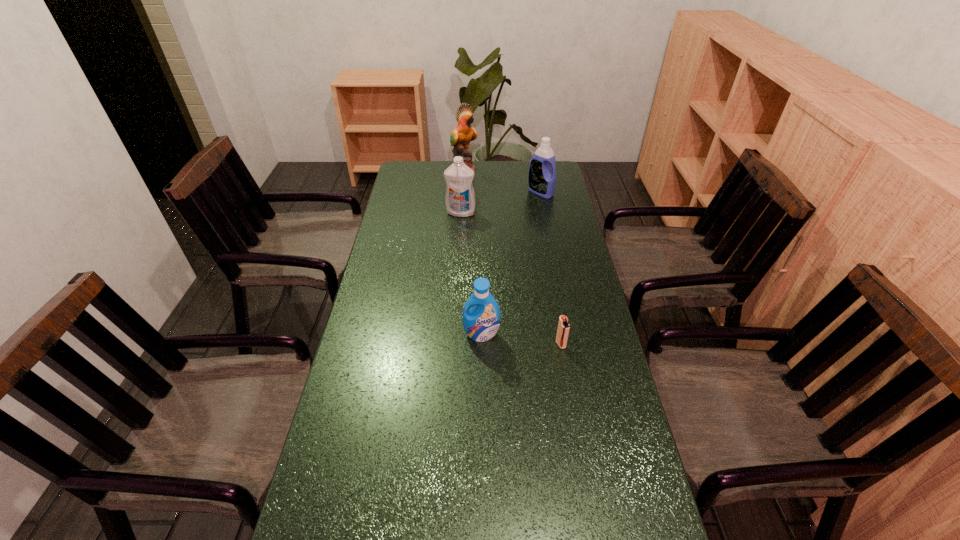
Locate an element on the screen. vacant space at the right edge of the desktop is located at coordinates (567, 253).

You are a GUI agent. You are given a task and a screenshot of the screen. Output one action in this format:
    pyautogui.click(x=<x>, y=<y>)
    Task: Click on the free space at the far left corner
    
    Given the screenshot: What is the action you would take?
    pyautogui.click(x=433, y=168)

This screenshot has width=960, height=540. I want to click on vacant point located between the farthest object and the fourth tallest object, so click(x=472, y=252).

I want to click on free space between the igniter and the farthest object, so click(513, 257).

You are a GUI agent. You are given a task and a screenshot of the screen. Output one action in this format:
    pyautogui.click(x=<x>, y=<y>)
    Task: Click on the free space that is in between the parrot and the shortest object
    The image size is (960, 540).
    Given the screenshot: What is the action you would take?
    pyautogui.click(x=513, y=257)

Identify the location of free space between the farthest object and the rightmost detergent. (502, 181).

I want to click on blank region between the second farthest detergent and the shortest object, so click(x=511, y=279).

Locate an element on the screen. The height and width of the screenshot is (540, 960). free space between the parrot and the fourth nearest object is located at coordinates (502, 181).

In order to click on free spot between the tallest object and the shortest object in this screenshot , I will do `click(513, 257)`.

Find the location of a particular element. vacant area between the second shortest object and the igniter is located at coordinates (521, 339).